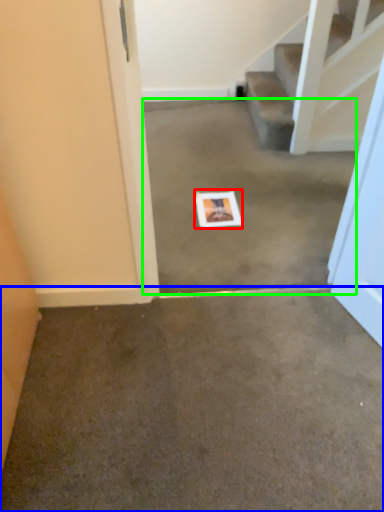
Question: Considering the real-world distances, which object is closest to postcard (highlighted by a red box)? concrete (highlighted by a blue box) or concrete (highlighted by a green box).

Choices:
 (A) concrete
 (B) concrete

Answer: (B)